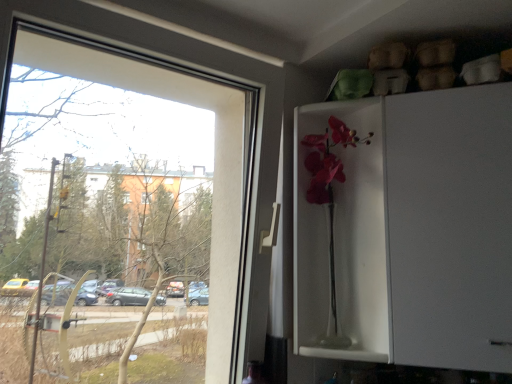
Question: Is matte glass vase at center facing towards transparent glass window at left?

Choices:
 (A) yes
 (B) no

Answer: (B)

Question: Considering the relative sizes of matte glass vase at center and transparent glass window at left in the image provided, is matte glass vase at center thinner than transparent glass window at left?

Choices:
 (A) yes
 (B) no

Answer: (B)

Question: Is matte glass vase at center in front of transparent glass window at left?

Choices:
 (A) no
 (B) yes

Answer: (A)

Question: Does matte glass vase at center appear on the left side of transparent glass window at left?

Choices:
 (A) yes
 (B) no

Answer: (B)

Question: From a real-world perspective, is matte glass vase at center on top of transparent glass window at left?

Choices:
 (A) yes
 (B) no

Answer: (B)

Question: Is transparent glass window at left inside the boundaries of white glossy cabinet at upper right, or outside?

Choices:
 (A) inside
 (B) outside

Answer: (B)

Question: Considering the positions of point (281, 72) and point (467, 172), is point (281, 72) closer or farther from the camera than point (467, 172)?

Choices:
 (A) farther
 (B) closer

Answer: (A)

Question: In terms of size, does transparent glass window at left appear bigger or smaller than white glossy cabinet at upper right?

Choices:
 (A) big
 (B) small

Answer: (B)

Question: In terms of height, does transparent glass window at left look taller or shorter compared to white glossy cabinet at upper right?

Choices:
 (A) short
 (B) tall

Answer: (B)

Question: In terms of width, does white glossy cabinet at upper right look wider or thinner when compared to transparent glass window at left?

Choices:
 (A) thin
 (B) wide

Answer: (B)

Question: Considering the relative positions of white glossy cabinet at upper right and transparent glass window at left in the image provided, is white glossy cabinet at upper right to the left or to the right of transparent glass window at left?

Choices:
 (A) left
 (B) right

Answer: (B)

Question: From the image's perspective, is white glossy cabinet at upper right positioned above or below transparent glass window at left?

Choices:
 (A) above
 (B) below

Answer: (B)

Question: In the image, is white glossy cabinet at upper right positioned in front of or behind transparent glass window at left?

Choices:
 (A) behind
 (B) front

Answer: (A)

Question: Does point (504, 168) appear closer or farther from the camera than point (296, 228)?

Choices:
 (A) closer
 (B) farther

Answer: (A)

Question: In terms of width, does white glossy cabinet at upper right look wider or thinner when compared to matte glass vase at center?

Choices:
 (A) wide
 (B) thin

Answer: (A)